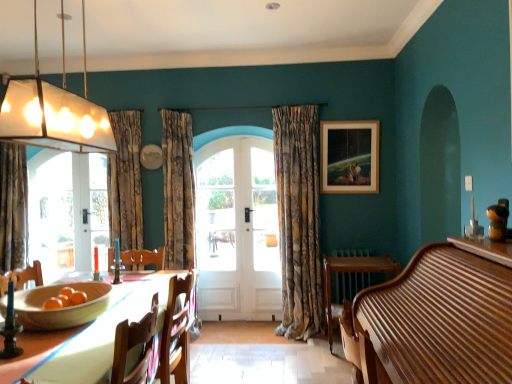
Question: In terms of width, does translucent glass pendant light at upper left look wider or thinner when compared to wooden round table at lower right?

Choices:
 (A) thin
 (B) wide

Answer: (A)

Question: Considering their positions, is translucent glass pendant light at upper left located in front of or behind wooden round table at lower right?

Choices:
 (A) behind
 (B) front

Answer: (B)

Question: Estimate the real-world distances between objects in this image. Which object is closer to the wooden round table at lower right?

Choices:
 (A) wooden table at lower left
 (B) textured beige curtain at center, which is counted as the first curtain, starting from the right
 (C) wooden piano at right
 (D) wooden bowl at lower left
 (E) clear glass door at left

Answer: (B)

Question: Which object is positioned farthest from the white wooden door at center?

Choices:
 (A) wooden picture frame at upper right
 (B) textured beige curtain at center, the 2th curtain in the right-to-left sequence
 (C) white wooden door at center
 (D) wooden piano at right
 (E) white wood screen door at center

Answer: (D)